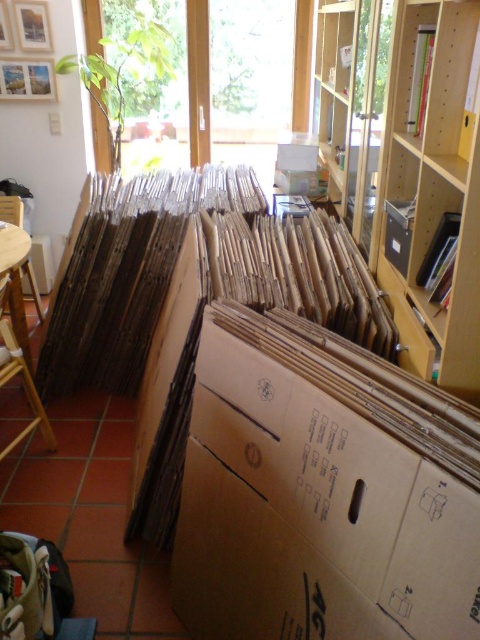
Question: Which point appears closest to the camera in this image?

Choices:
 (A) (409, 234)
 (B) (335, 509)

Answer: (B)

Question: Is brown cardboard box at center below wooden bookshelf at center?

Choices:
 (A) no
 (B) yes

Answer: (B)

Question: Is brown cardboard box at center positioned behind wooden bookshelf at center?

Choices:
 (A) no
 (B) yes

Answer: (A)

Question: Among these points, which one is farthest from the camera?

Choices:
 (A) (477, 196)
 (B) (344, 352)

Answer: (B)

Question: Can you confirm if brown cardboard box at center is wider than wooden bookshelf at center?

Choices:
 (A) no
 (B) yes

Answer: (B)